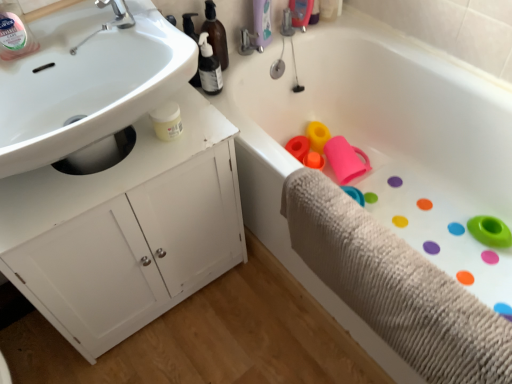
Locate an element on the screen. This screenshot has width=512, height=384. empty space that is ontop of white matte cabinet at left (from a real-world perspective) is located at coordinates (75, 182).